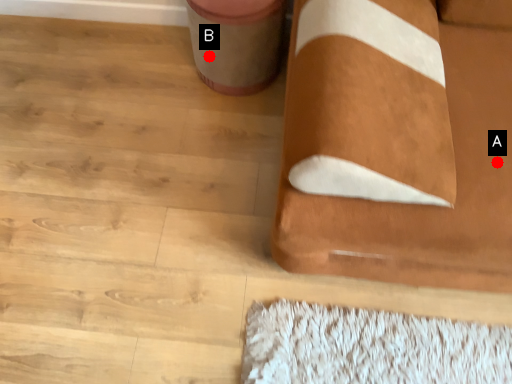
Question: Two points are circled on the image, labeled by A and B beside each circle. Which point is farther from the camera taking this photo?

Choices:
 (A) A is further
 (B) B is further

Answer: (B)